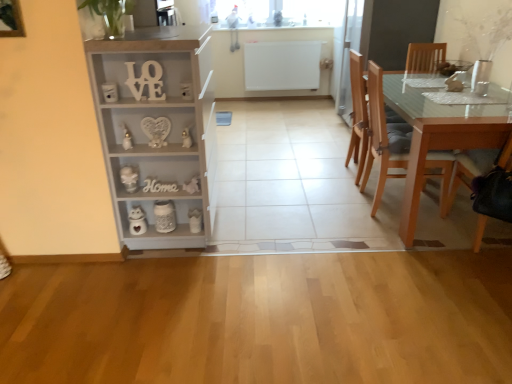
Question: Considering the relative sizes of light brown wooden chair at right, which ranks as the 2th chair in back-to-front order, and wooden chair at right, the 3th chair when ordered from back to front, in the image provided, is light brown wooden chair at right, which ranks as the 2th chair in back-to-front order, wider than wooden chair at right, the 3th chair when ordered from back to front,?

Choices:
 (A) no
 (B) yes

Answer: (A)

Question: From a real-world perspective, is light brown wooden chair at right, which ranks as the 2th chair in back-to-front order, under wooden chair at right, placed as the first chair when sorted from front to back?

Choices:
 (A) yes
 (B) no

Answer: (B)

Question: Does light brown wooden chair at right, the 2th chair from the front, have a larger size compared to wooden chair at right, the 3th chair when ordered from back to front?

Choices:
 (A) yes
 (B) no

Answer: (A)

Question: Does light brown wooden chair at right, which ranks as the 2th chair in back-to-front order, have a greater height compared to wooden chair at right, placed as the first chair when sorted from front to back?

Choices:
 (A) yes
 (B) no

Answer: (A)

Question: Is the depth of light brown wooden chair at right, which ranks as the 2th chair in back-to-front order, less than that of wooden chair at right, placed as the first chair when sorted from front to back?

Choices:
 (A) yes
 (B) no

Answer: (B)

Question: From their relative heights in the image, would you say light brown wood chair at right, acting as the third chair starting from the front, is taller or shorter than light gray wood cabinet at left?

Choices:
 (A) short
 (B) tall

Answer: (A)

Question: Looking at the image, does light brown wood chair at right, acting as the third chair starting from the front, seem bigger or smaller compared to light gray wood cabinet at left?

Choices:
 (A) big
 (B) small

Answer: (B)

Question: From a real-world perspective, is light brown wood chair at right, acting as the third chair starting from the front, above or below light gray wood cabinet at left?

Choices:
 (A) above
 (B) below

Answer: (B)

Question: Considering the positions of light brown wood chair at right, acting as the third chair starting from the front, and light gray wood cabinet at left in the image, is light brown wood chair at right, acting as the third chair starting from the front, wider or thinner than light gray wood cabinet at left?

Choices:
 (A) wide
 (B) thin

Answer: (B)

Question: Looking at the image, does light gray wood cabinet at left seem bigger or smaller compared to white glossy vase at lower left?

Choices:
 (A) big
 (B) small

Answer: (A)

Question: Is light gray wood cabinet at left to the left or to the right of white glossy vase at lower left in the image?

Choices:
 (A) right
 (B) left

Answer: (A)

Question: From a real-world perspective, relative to white glossy vase at lower left, is light gray wood cabinet at left vertically above or below?

Choices:
 (A) above
 (B) below

Answer: (A)

Question: Is light gray wood cabinet at left wider or thinner than white glossy vase at lower left?

Choices:
 (A) thin
 (B) wide

Answer: (B)

Question: Looking at the image, does light brown wooden chair at right, which ranks as the 2th chair in back-to-front order, seem bigger or smaller compared to white matte wooden letters at upper center?

Choices:
 (A) big
 (B) small

Answer: (A)

Question: In the image, is light brown wooden chair at right, the 2th chair from the front, positioned in front of or behind white matte wooden letters at upper center?

Choices:
 (A) front
 (B) behind

Answer: (B)